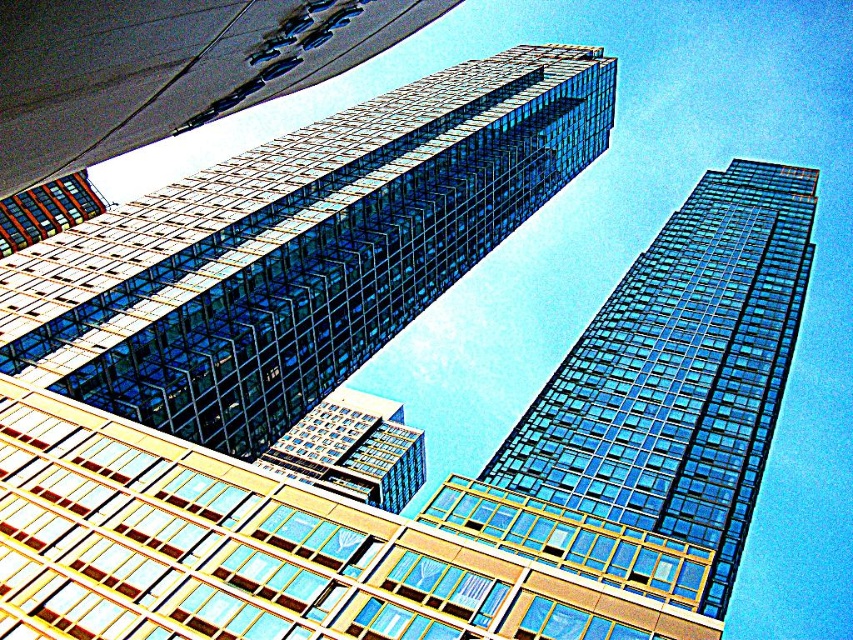
Is transparent glass skyscraper at upper right wider than clear glass building at center?

Indeed, transparent glass skyscraper at upper right has a greater width compared to clear glass building at center.

Between transparent glass skyscraper at upper right and clear glass building at center, which one appears on the right side from the viewer's perspective?

Positioned to the right is transparent glass skyscraper at upper right.

Is point (706, 250) positioned before point (370, 412)?

That is True.

Locate an element on the screen. The image size is (853, 640). transparent glass skyscraper at upper right is located at coordinates (660, 403).

Who is more forward, (x=451, y=138) or (x=657, y=269)?

Point (x=451, y=138) is in front.

Who is more distant from viewer, (x=125, y=317) or (x=595, y=532)?

Positioned behind is point (x=595, y=532).

I want to click on transparent glass building at upper center, so click(299, 250).

Who is positioned more to the right, transparent glass building at upper center or clear glass building at center?

From the viewer's perspective, transparent glass building at upper center appears more on the right side.

Can you confirm if transparent glass building at upper center is thinner than clear glass building at center?

In fact, transparent glass building at upper center might be wider than clear glass building at center.

Find the location of `transparent glass building at upper center`. transparent glass building at upper center is located at coordinates (299, 250).

You are a GUI agent. You are given a task and a screenshot of the screen. Output one action in this format:
    pyautogui.click(x=<x>, y=<y>)
    Task: Click on the transparent glass building at upper center
    The image size is (853, 640).
    Given the screenshot: What is the action you would take?
    pyautogui.click(x=299, y=250)